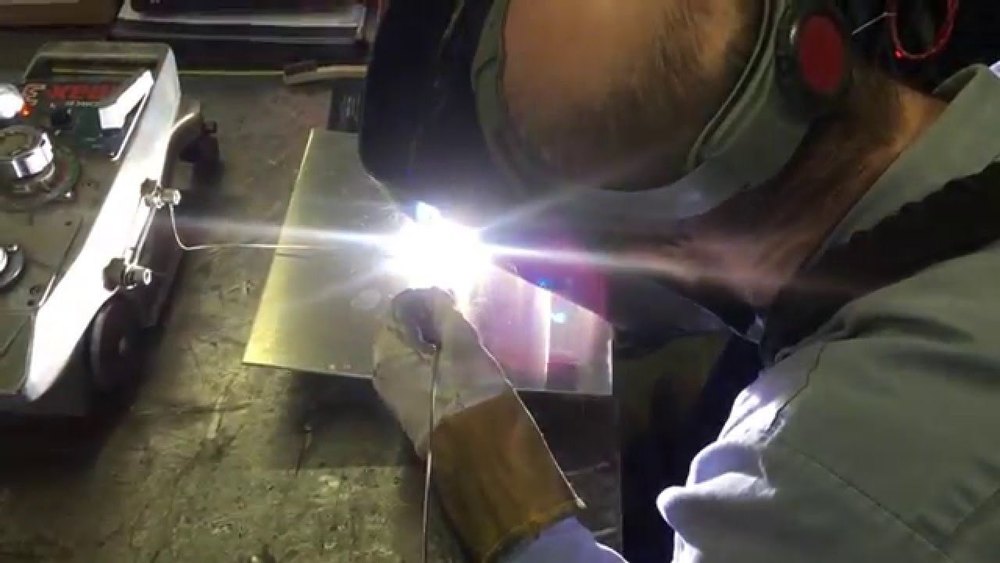
Identify the location of knobs. Image resolution: width=1000 pixels, height=563 pixels. (138, 277), (170, 196).